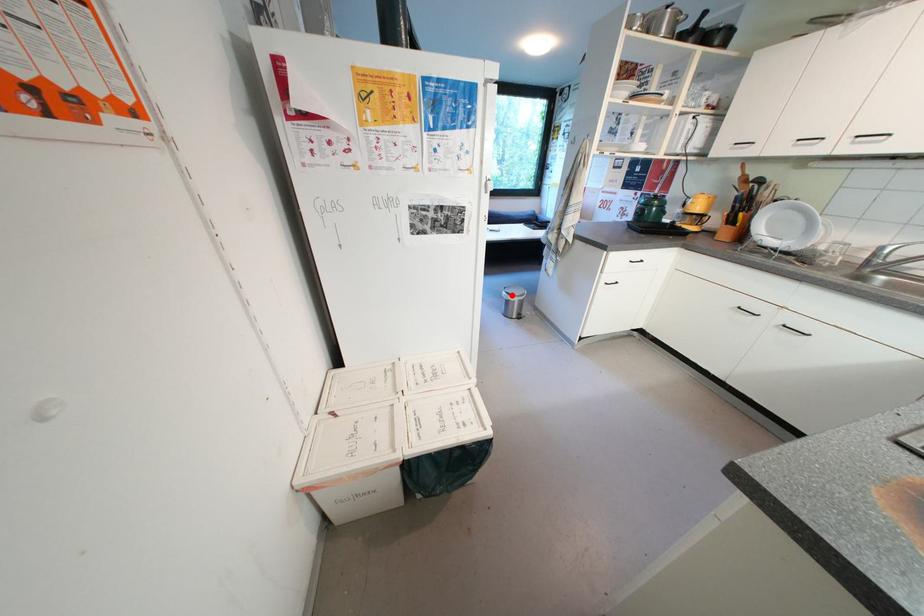
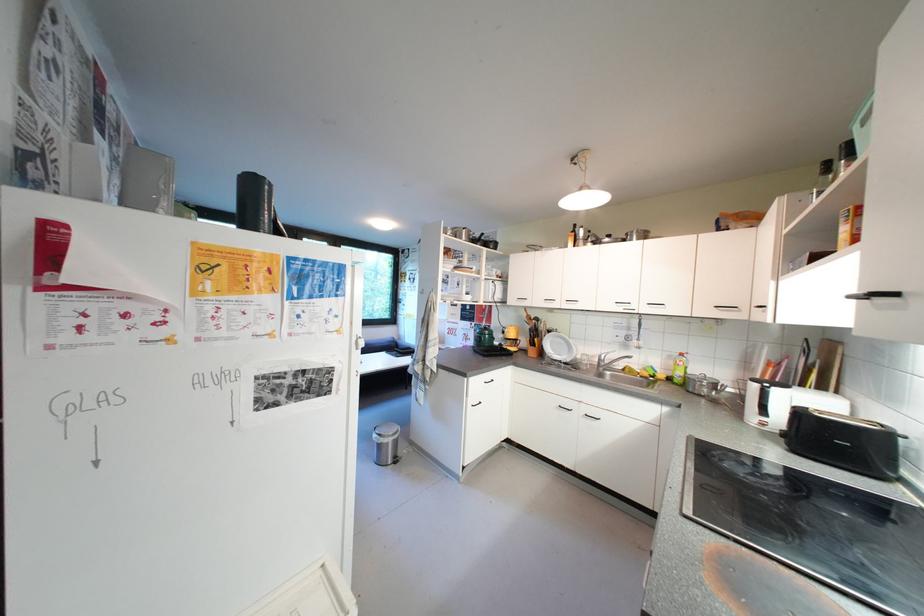
In the second image, find the point that corresponds to the highlighted location in the first image.

(383, 438)